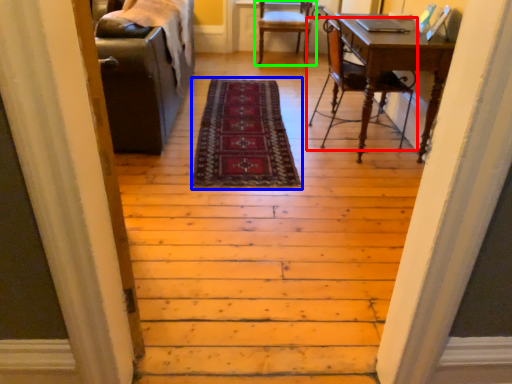
Question: Estimate the real-world distances between objects in this image. Which object is farther from chair (highlighted by a red box), mat (highlighted by a blue box) or chair (highlighted by a green box)?

Choices:
 (A) mat
 (B) chair

Answer: (B)